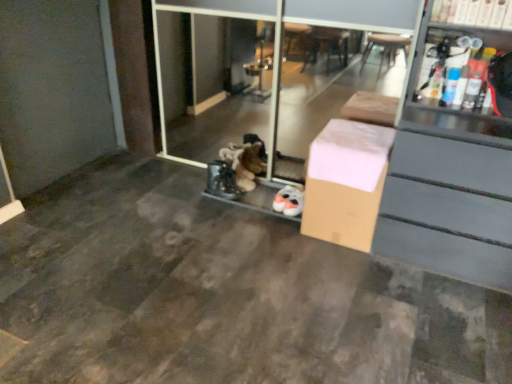
Question: Should I look upward or downward to see transparent glass screen door at center?

Choices:
 (A) up
 (B) down

Answer: (A)

Question: Considering the relative positions of white cardboard box at upper right and transparent glass screen door at center in the image provided, is white cardboard box at upper right to the left of transparent glass screen door at center from the viewer's perspective?

Choices:
 (A) no
 (B) yes

Answer: (A)

Question: Are white cardboard box at upper right and transparent glass screen door at center located far from each other?

Choices:
 (A) no
 (B) yes

Answer: (B)

Question: Are white cardboard box at upper right and transparent glass screen door at center beside each other?

Choices:
 (A) no
 (B) yes

Answer: (A)

Question: Considering the relative sizes of white cardboard box at upper right and transparent glass screen door at center in the image provided, is white cardboard box at upper right thinner than transparent glass screen door at center?

Choices:
 (A) no
 (B) yes

Answer: (A)

Question: Can you confirm if white cardboard box at upper right is taller than transparent glass screen door at center?

Choices:
 (A) yes
 (B) no

Answer: (B)

Question: From the image's perspective, does white cardboard box at upper right appear lower than transparent glass screen door at center?

Choices:
 (A) yes
 (B) no

Answer: (B)

Question: Is transparent glass screen door at center positioned beyond the bounds of white cardboard box at upper right?

Choices:
 (A) yes
 (B) no

Answer: (A)

Question: From the image's perspective, is transparent glass screen door at center over white cardboard box at upper right?

Choices:
 (A) yes
 (B) no

Answer: (B)

Question: Could you tell me if transparent glass screen door at center is facing white cardboard box at upper right?

Choices:
 (A) no
 (B) yes

Answer: (A)

Question: From the image's perspective, is transparent glass screen door at center below white cardboard box at upper right?

Choices:
 (A) no
 (B) yes

Answer: (B)

Question: Is transparent glass screen door at center in contact with white cardboard box at upper right?

Choices:
 (A) no
 (B) yes

Answer: (A)

Question: Is transparent glass screen door at center taller than white cardboard box at upper right?

Choices:
 (A) yes
 (B) no

Answer: (A)

Question: Does brown cardboard box at center have a lesser height compared to white cardboard box at upper right?

Choices:
 (A) yes
 (B) no

Answer: (B)